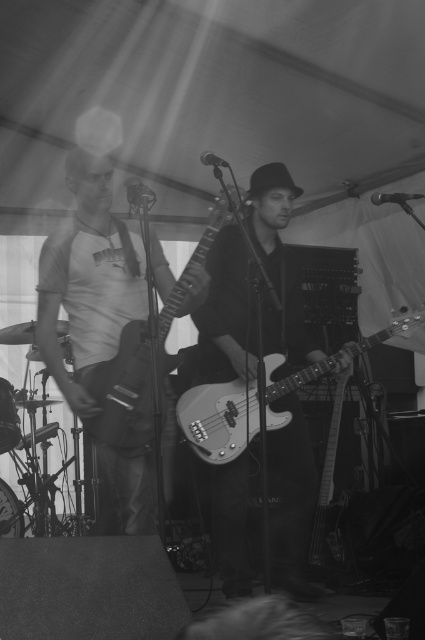
You are a technician adjusting the stage setup. You need to place a new microphone stand at position point 0.452, 0.593. Is there enough space there because the metallic bass guitar at center is currently occupying that area?

The metallic bass guitar at center is located at point (x=252, y=289), so placing the microphone stand at that exact position would not be possible as the bass guitar is already there.

You are standing in front of the stage and want to know which of the two points, point (x=204, y=442) or point (x=110, y=412), is closer to you. Which one is it?

Point (x=204, y=442) is further to the viewer than point (x=110, y=412), so the point closer to you is point (x=110, y=412).

Consider the image. You are a stagehand setting up for a live performance. You need to place a 1.2 meter long amplifier between the metallic silver bass guitar at center and the matte black bass at center. Considering their sizes, will the amplifier fit between them?

The metallic silver bass guitar at center is shorter than the matte black bass at center. Since the amplifier is 1.2 meters long, it depends on the distance between the two bass guitars. However, the description only provides information about their heights, not the space between them. Therefore, we cannot determine if the amplifier will fit based on the given details.